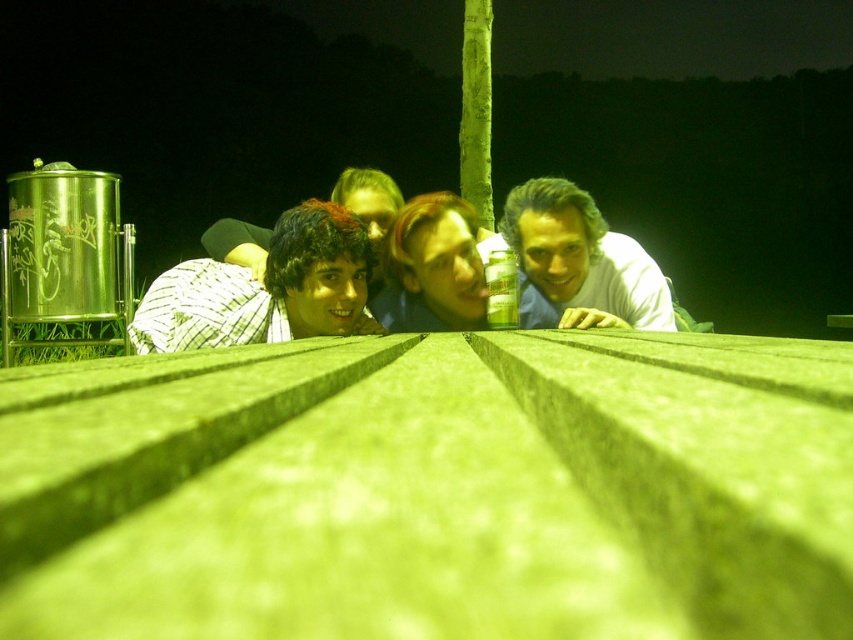
Question: Estimate the real-world distances between objects in this image. Which object is farther from the smooth skin face at center?

Choices:
 (A) matte white shirt at upper right
 (B) plaid shirt at center
 (C) shiny black hair at center

Answer: (B)

Question: Does plaid shirt at center lie behind matte white shirt at upper right?

Choices:
 (A) yes
 (B) no

Answer: (B)

Question: Is smooth skin face at center to the left of shiny black hair at center from the viewer's perspective?

Choices:
 (A) yes
 (B) no

Answer: (B)

Question: Which object is the closest to the plaid shirt at center?

Choices:
 (A) smooth skin face at center
 (B) shiny black hair at center

Answer: (A)

Question: Does matte white shirt at upper right have a lesser width compared to smooth skin face at center?

Choices:
 (A) yes
 (B) no

Answer: (A)

Question: Among these points, which one is farthest from the camera?

Choices:
 (A) (572, 273)
 (B) (325, 316)
 (C) (454, 202)
 (D) (241, 234)

Answer: (D)